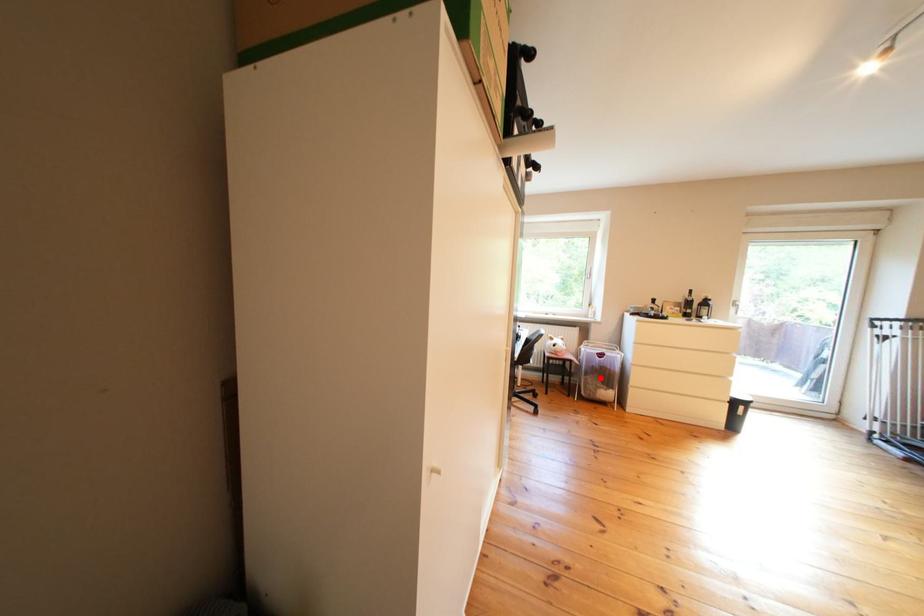
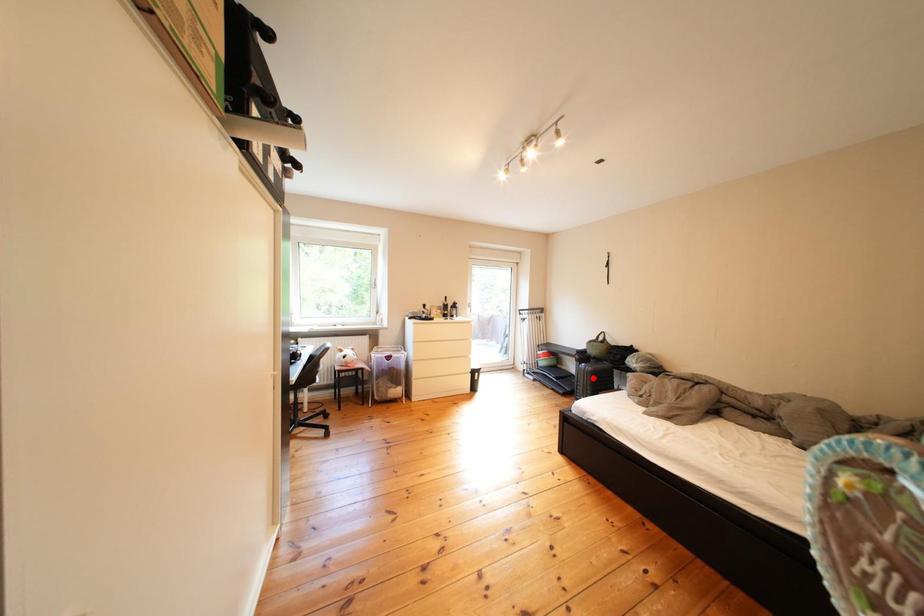
I am providing you with two images of the same scene from different viewpoints. A red point is marked on the first image and another point is marked on the second image. Is the marked point in image1 the same physical position as the marked point in image2?

No